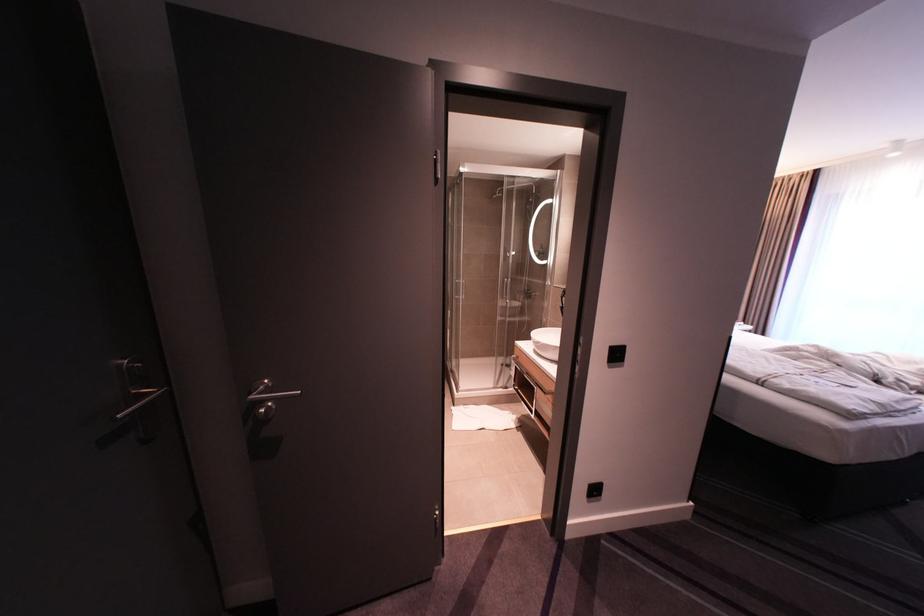
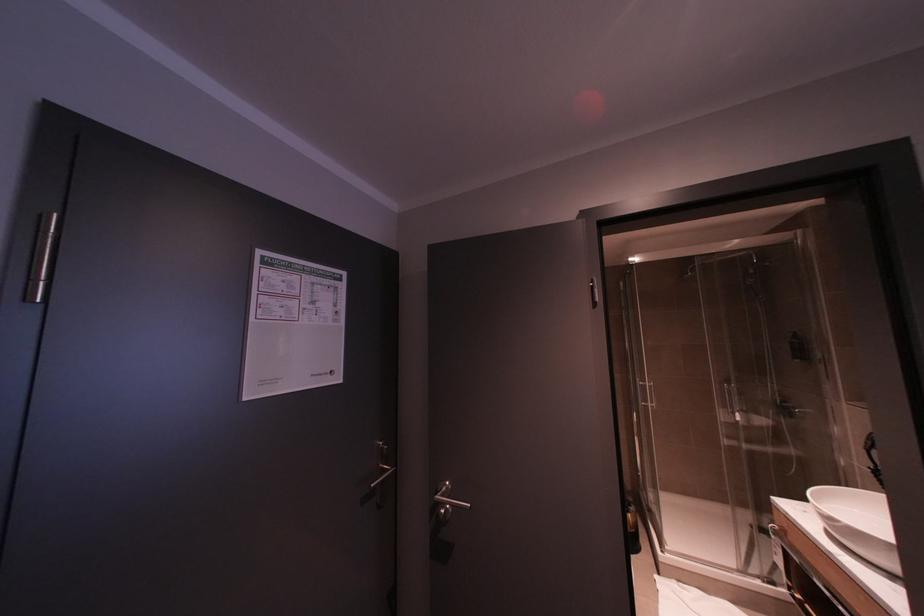
Locate, in the second image, the point that corresponds to point 266,408 in the first image.

(446, 509)